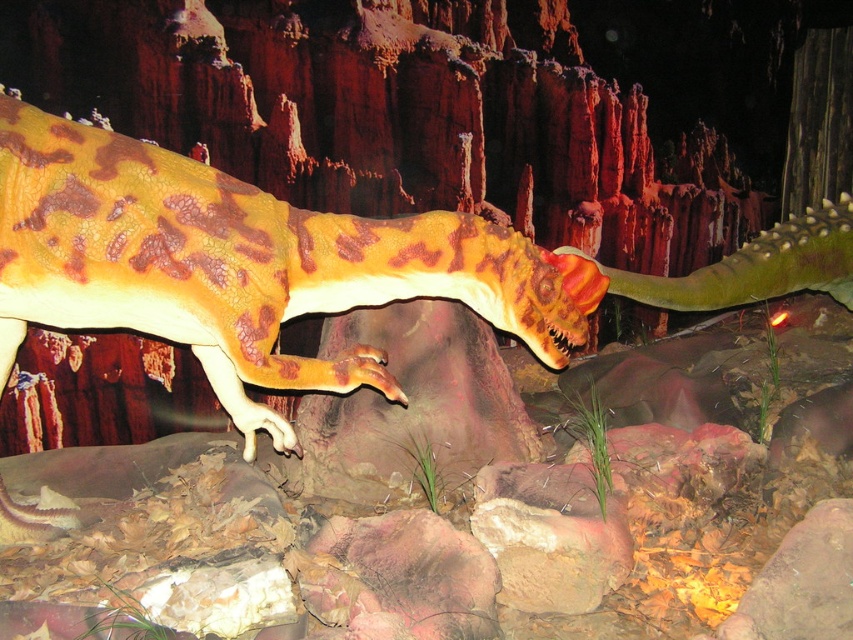
Question: Which point is farther to the camera?

Choices:
 (A) (456, 259)
 (B) (834, 600)

Answer: (A)

Question: Is camouflage plastic dinosaur at center positioned in front of rustic stone at lower right?

Choices:
 (A) yes
 (B) no

Answer: (B)

Question: Which object is farther from the camera taking this photo?

Choices:
 (A) rustic stone at lower right
 (B) camouflage plastic dinosaur at center

Answer: (B)

Question: Does camouflage plastic dinosaur at center have a smaller size compared to rustic stone at lower right?

Choices:
 (A) no
 (B) yes

Answer: (A)

Question: Among these points, which one is farthest from the camera?

Choices:
 (A) (107, 134)
 (B) (851, 538)

Answer: (A)

Question: Is camouflage plastic dinosaur at center smaller than rustic stone at lower right?

Choices:
 (A) yes
 (B) no

Answer: (B)